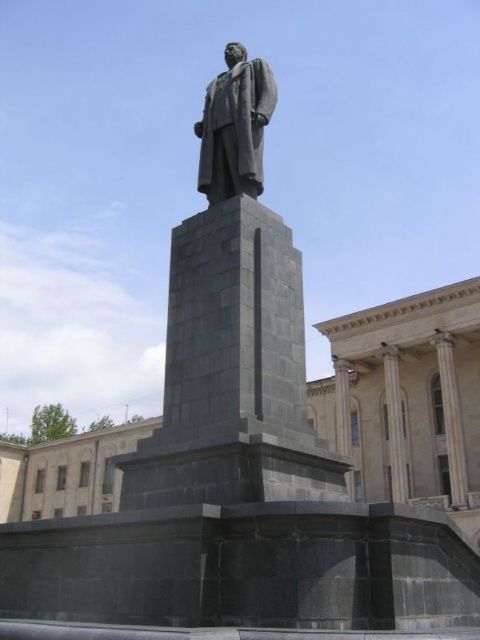
You are standing in front of a statue on a pedestal in a classical building. You notice a specific point at coordinates (232, 330). What object is located at this point?

The point at coordinates (232, 330) corresponds to the matte gray statue at center.

You are standing at the point marked by the coordinates point (213, 237). You want to take a photo of the statue on the pedestal while ensuring that the classical building in the background is fully visible. Given your current position, can you determine if the statue and the building are within your camera frame? Please explain your reasoning based on the spatial relationship between your position and the objects.

Result: The point marked by the coordinates point (213, 237) is 20.17 meters away from the viewer. Since the statue and the classical building are both within the same general area and the distance is sufficient for capturing both in a single frame, it is likely possible to include both in the photo. However, the exact composition would depend on the camera lens and field of view.